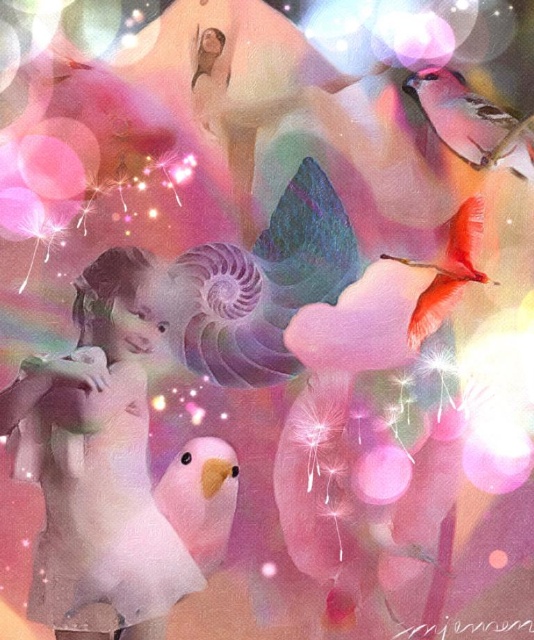
You are an artist trying to draw this scene. You want to ensure that the point at position point [129,620] and the point at position point [458,97] are correctly placed in terms of depth. Which point should you draw closer to the front of your painting?

Point point [129,620] should be drawn closer to the front of the painting since it is closer to the camera than point point [458,97] according to the description.

You are an artist trying to paint this scene. You need to decide the size of the matte pink parrot at upper right and the matte pink flamingo at upper right. Which one should you make larger in your painting?

The matte pink flamingo at upper right should be painted larger because the matte pink parrot at upper right is smaller than the matte pink flamingo at upper right.